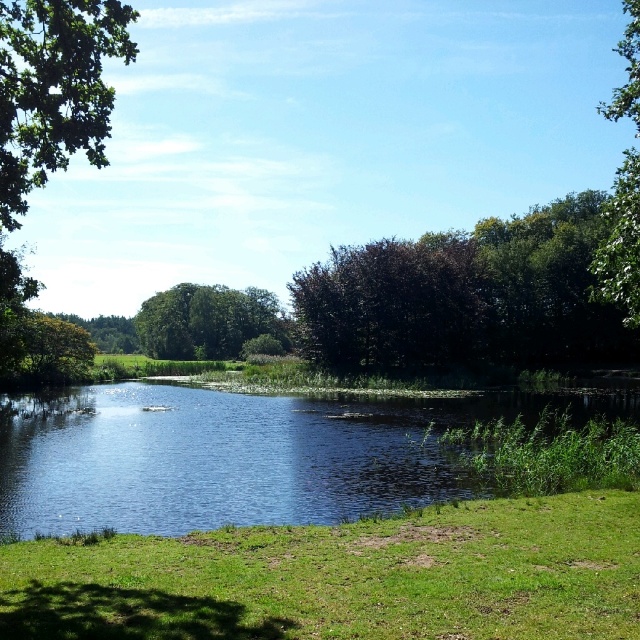
You are standing at the edge of the scene and want to locate the clear blue water at center. According to the coordinates provided, in which direction should you look to find it?

The clear blue water at center is located at coordinates point (237, 454), so you should look towards the upper right direction to find it.

You are standing at the edge of the water in the scene. Which tree, the green leafy tree at center or the green leafy tree at upper right, would appear taller to you?

The green leafy tree at upper right appears taller than the green leafy tree at center because it has a greater height according to the description.